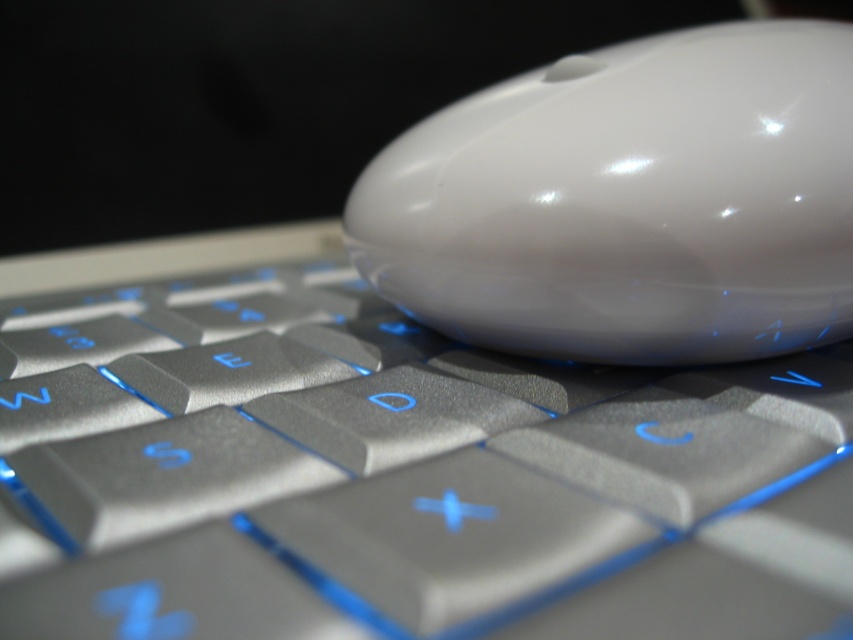
You need to place a protective cover over both the satin silver keyboard at center and the white glossy mouse at upper center. Since the cover must fit over both objects, which object determines the minimum required size of the cover?

The satin silver keyboard at center is bigger than the white glossy mouse at upper center, so the cover must be sized to accommodate the satin silver keyboard at center.

You need to place a 5 inch long ruler between the satin silver keyboard at center and the white glossy mouse at upper center. Will it fit without overlapping either object?

A: The distance between the satin silver keyboard at center and the white glossy mouse at upper center is 5.14 inches. Since the ruler is 5 inches long, it will fit between them without overlapping either object as there is enough space.